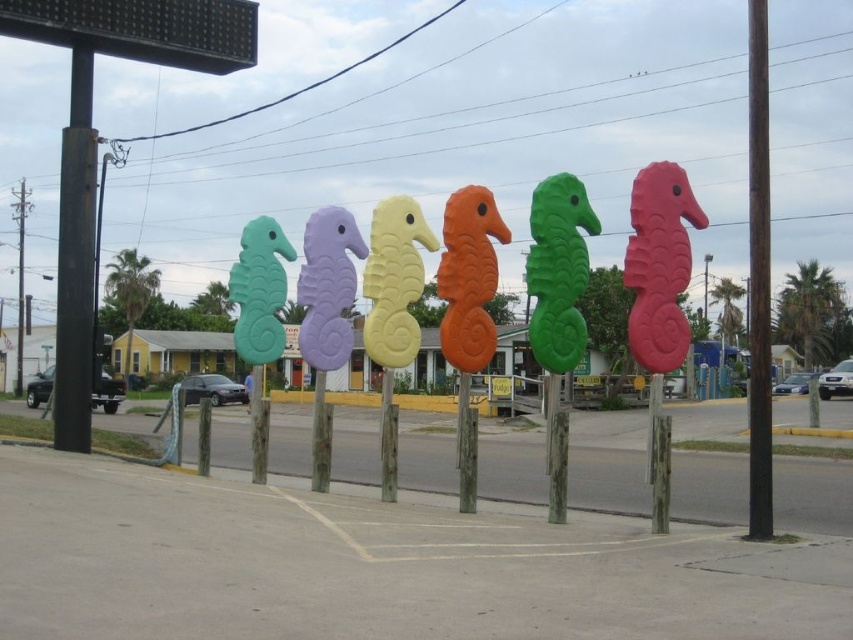
Does black metal pole at left come behind white plastic sign at center?

No, it is in front of white plastic sign at center.

Between black metal pole at left and white plastic sign at center, which one has less height?

Standing shorter between the two is white plastic sign at center.

Locate an element on the screen. black metal pole at left is located at coordinates (74, 262).

Does brown wooden pole at right appear on the left side of white plastic sign at center?

In fact, brown wooden pole at right is to the right of white plastic sign at center.

Find the location of `brown wooden pole at right`. brown wooden pole at right is located at coordinates (758, 278).

In order to click on brown wooden pole at right in this screenshot , I will do `click(758, 278)`.

Is point (90, 445) in front of point (766, 125)?

No.

Who is positioned more to the left, black metal pole at left or brown wooden pole at right?

black metal pole at left

Describe the element at coordinates (74, 262) in the screenshot. This screenshot has width=853, height=640. I see `black metal pole at left` at that location.

The height and width of the screenshot is (640, 853). What are the coordinates of `black metal pole at left` in the screenshot? It's located at (74, 262).